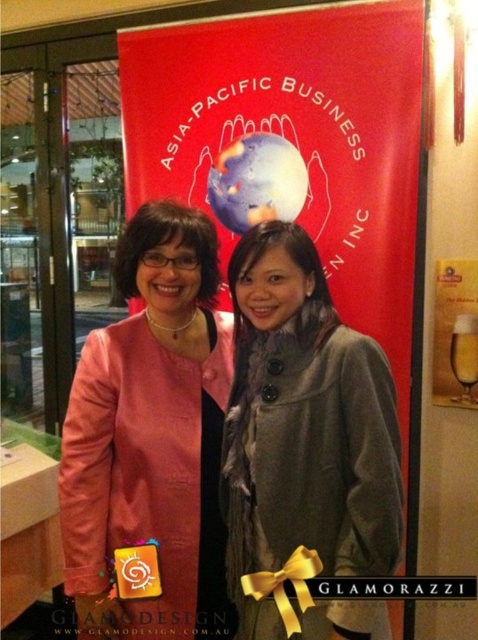
Is pink leather jacket at center to the left of gray wool coat at center from the viewer's perspective?

Indeed, pink leather jacket at center is positioned on the left side of gray wool coat at center.

Which is in front, point (192, 381) or point (387, 376)?

Point (387, 376) is more forward.

You are a GUI agent. You are given a task and a screenshot of the screen. Output one action in this format:
    pyautogui.click(x=<x>, y=<y>)
    Task: Click on the pink leather jacket at center
    This screenshot has width=478, height=640.
    Given the screenshot: What is the action you would take?
    pyautogui.click(x=151, y=438)

Who is lower down, red fabric banner at center or pink leather jacket at center?

pink leather jacket at center is below.

Looking at this image, does red fabric banner at center have a smaller size compared to pink leather jacket at center?

Incorrect, red fabric banner at center is not smaller in size than pink leather jacket at center.

You are a GUI agent. You are given a task and a screenshot of the screen. Output one action in this format:
    pyautogui.click(x=<x>, y=<y>)
    Task: Click on the red fabric banner at center
    
    Given the screenshot: What is the action you would take?
    pyautogui.click(x=297, y=138)

Is point (134, 35) closer to viewer compared to point (230, 582)?

No.

Is point (391, 243) behind point (384, 436)?

Yes, it is behind point (384, 436).

This screenshot has width=478, height=640. Identify the location of red fabric banner at center. (297, 138).